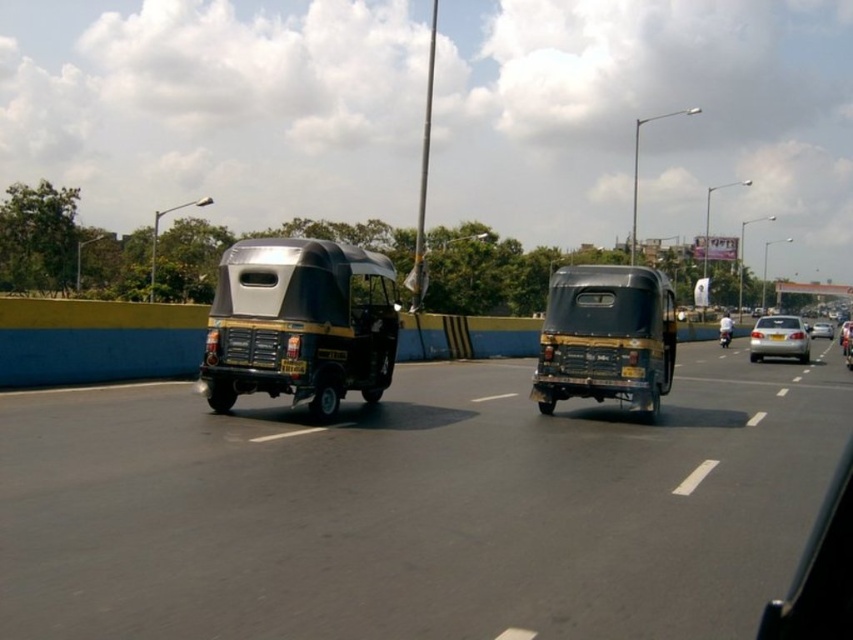
Question: Which of the following is the farthest from the observer?

Choices:
 (A) metallic tuk-tuk at center
 (B) metallic silver auto-rickshaw at center
 (C) silver metallic sedan at right
 (D) black matte auto-rickshaw at center

Answer: (B)

Question: Among these objects, which one is farthest from the camera?

Choices:
 (A) metallic tuk-tuk at center
 (B) silver metallic sedan at center
 (C) matte black auto-rickshaw at center

Answer: (B)

Question: Where is black matte auto-rickshaw at center located in relation to metallic silver auto-rickshaw at center in the image?

Choices:
 (A) left
 (B) right

Answer: (A)

Question: Can you confirm if metallic silver auto-rickshaw at center is smaller than silver metallic sedan at center?

Choices:
 (A) no
 (B) yes

Answer: (A)

Question: Estimate the real-world distances between objects in this image. Which object is farther from the metallic silver auto-rickshaw at center?

Choices:
 (A) silver metallic sedan at right
 (B) matte black auto-rickshaw at center

Answer: (B)

Question: Can you confirm if metallic silver auto-rickshaw at center is wider than silver metallic sedan at center?

Choices:
 (A) no
 (B) yes

Answer: (A)